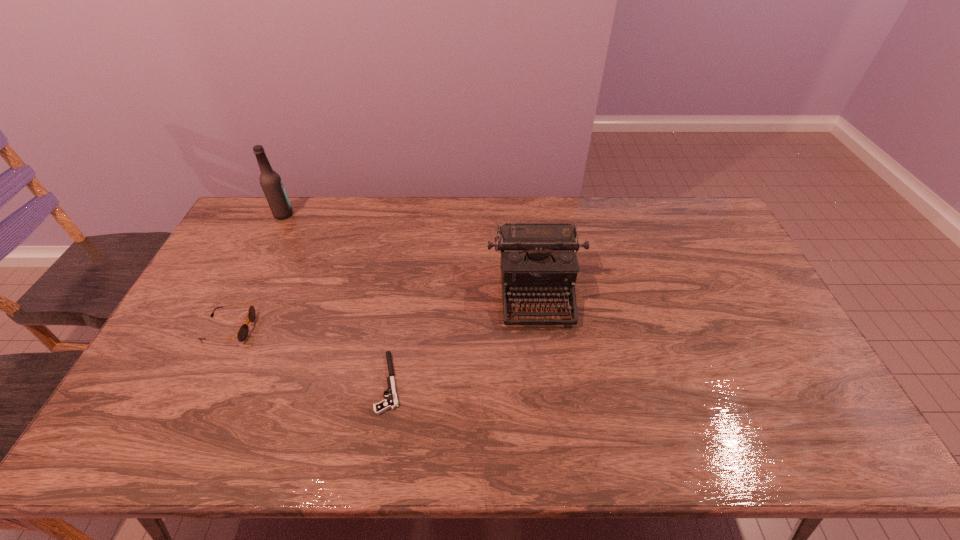
You are a GUI agent. You are given a task and a screenshot of the screen. Output one action in this format:
    pyautogui.click(x=<x>, y=<y>)
    Task: Click on the vacant area that lies between the typewriter and the nearest object
    This screenshot has width=960, height=540.
    Given the screenshot: What is the action you would take?
    pyautogui.click(x=463, y=337)

This screenshot has height=540, width=960. I want to click on free space that is in between the beer bottle and the second tallest object, so click(410, 253).

You are a GUI agent. You are given a task and a screenshot of the screen. Output one action in this format:
    pyautogui.click(x=<x>, y=<y>)
    Task: Click on the third closest object to the third shortest object
    The image size is (960, 540).
    Given the screenshot: What is the action you would take?
    pyautogui.click(x=270, y=181)

Find the location of `object that is the third closest one to the third shortest object`. object that is the third closest one to the third shortest object is located at coordinates (270, 181).

Find the location of a particular element. Image resolution: width=960 pixels, height=540 pixels. free region that satisfies the following two spatial constraints: 1. on the typing side of the third shortest object; 2. on the front-facing side of the second shortest object is located at coordinates (540, 328).

Locate an element on the screen. Image resolution: width=960 pixels, height=540 pixels. vacant region that satisfies the following two spatial constraints: 1. on the typing side of the rightmost object; 2. on the front-facing side of the nearest object is located at coordinates (546, 382).

Find the location of a particular element. This screenshot has height=540, width=960. free spot that satisfies the following two spatial constraints: 1. on the typing side of the rightmost object; 2. on the front-facing side of the pistol is located at coordinates (546, 382).